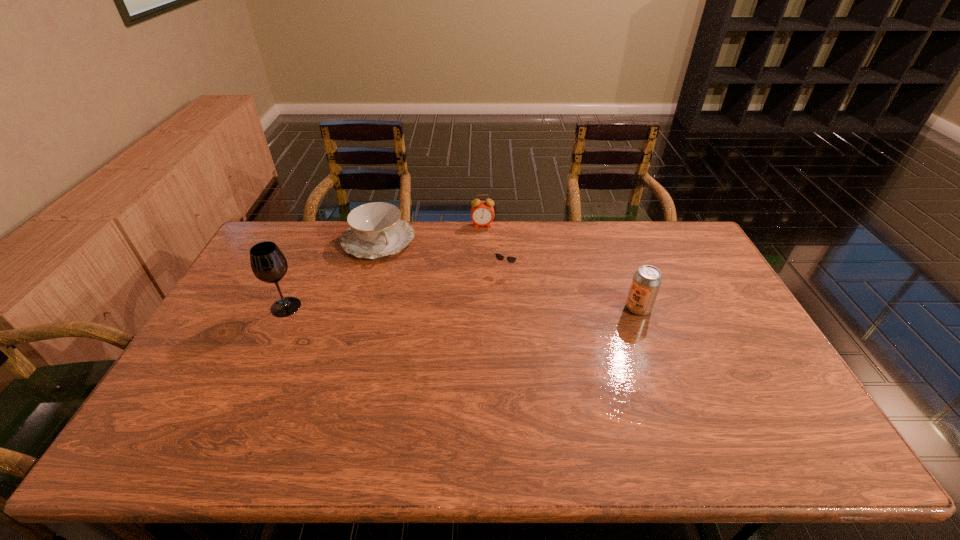
Locate an element on the screen. free space that satisfies the following two spatial constraints: 1. on the back side of the sunglasses; 2. on the left side of the wineglass is located at coordinates (304, 268).

Find the location of a particular element. free space that satisfies the following two spatial constraints: 1. on the front side of the beer can; 2. on the right side of the chinaware is located at coordinates (359, 308).